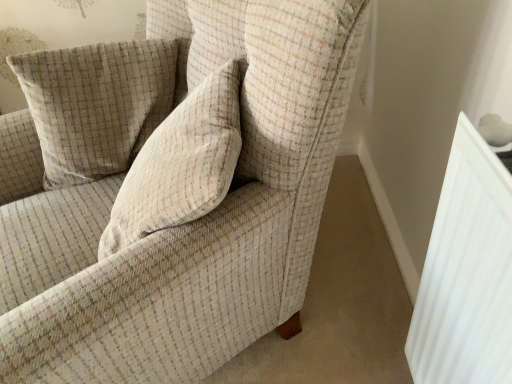
What is the approximate height of textured beige armchair at center?

36.26 inches.

Measure the distance between beige textured cushion at upper left and camera.

The depth of beige textured cushion at upper left is 38.02 inches.

Find the location of a particular element. The height and width of the screenshot is (384, 512). white ribbed radiator at right is located at coordinates (466, 272).

Find the location of a particular element. The image size is (512, 384). textured beige armchair at center is located at coordinates (169, 189).

Based on the photo, can you tell me how much textured beige armchair at center and white ribbed radiator at right differ in facing direction?

30.8 degrees.

Is textured beige armchair at center positioned with its back to white ribbed radiator at right?

No, textured beige armchair at center's orientation is not away from white ribbed radiator at right.

From the image's perspective, which object appears higher, textured beige armchair at center or white ribbed radiator at right?

textured beige armchair at center, from the image's perspective.

Measure the distance from textured beige armchair at center to white ribbed radiator at right.

A distance of 18.83 inches exists between textured beige armchair at center and white ribbed radiator at right.

From the image's perspective, which is below, white ribbed radiator at right or beige textured cushion at upper left?

From the image's view, white ribbed radiator at right is below.

Considering the points (434, 256) and (155, 45), which point is in front, point (434, 256) or point (155, 45)?

Point (434, 256)

Is white ribbed radiator at right oriented towards beige textured cushion at upper left?

No, white ribbed radiator at right is not turned towards beige textured cushion at upper left.

Can you confirm if white ribbed radiator at right is smaller than beige textured cushion at upper left?

Yes.

Does beige textured cushion at upper left have a greater width compared to textured beige armchair at center?

In fact, beige textured cushion at upper left might be narrower than textured beige armchair at center.

Measure the distance between beige textured cushion at upper left and textured beige armchair at center.

They are 17.79 centimeters apart.

Considering the positions of objects beige textured cushion at upper left and textured beige armchair at center in the image provided, who is behind, beige textured cushion at upper left or textured beige armchair at center?

beige textured cushion at upper left is further away from the camera.

How many degrees apart are the facing directions of beige textured cushion at upper left and textured beige armchair at center?

The angular difference between beige textured cushion at upper left and textured beige armchair at center is 73.9 degrees.

Which is behind, point (154, 288) or point (146, 71)?

The point (146, 71) is farther.

Which object is further away from the camera, textured beige armchair at center or beige textured cushion at upper left?

beige textured cushion at upper left is further from the camera.

Is textured beige armchair at center positioned beyond the bounds of beige textured cushion at upper left?

Indeed, textured beige armchair at center is completely outside beige textured cushion at upper left.

What are the coordinates of `chair located below the beige textured cushion at upper left (from the image's perspective)` in the screenshot? It's located at (169, 189).

Does white ribbed radiator at right touch textured beige armchair at center?

No, white ribbed radiator at right is not with textured beige armchair at center.

Based on their sizes in the image, would you say white ribbed radiator at right is bigger or smaller than textured beige armchair at center?

In the image, white ribbed radiator at right appears to be smaller than textured beige armchair at center.

Between white ribbed radiator at right and textured beige armchair at center, which one is positioned in front?

textured beige armchair at center is more forward.

From the image's perspective, is white ribbed radiator at right located above or below textured beige armchair at center?

Clearly, from the image's perspective, white ribbed radiator at right is below textured beige armchair at center.

Between beige textured cushion at upper left and white ribbed radiator at right, which one appears on the left side from the viewer's perspective?

Positioned to the left is beige textured cushion at upper left.

Is beige textured cushion at upper left situated inside white ribbed radiator at right or outside?

beige textured cushion at upper left exists outside the volume of white ribbed radiator at right.

From the image's perspective, does beige textured cushion at upper left appear lower than white ribbed radiator at right?

No.

Between beige textured cushion at upper left and white ribbed radiator at right, which one has larger width?

beige textured cushion at upper left.

At what (x,y) coordinates should I click in order to perform the action: click on radiator behind the textured beige armchair at center. Please return your answer as a coordinate pair (x, y). The height and width of the screenshot is (384, 512). Looking at the image, I should click on (466, 272).

Find the location of `radiator in front of the beige textured cushion at upper left`. radiator in front of the beige textured cushion at upper left is located at coordinates (466, 272).

When comparing their distances from beige textured cushion at upper left, does textured beige armchair at center or white ribbed radiator at right seem closer?

textured beige armchair at center.

When comparing their distances from white ribbed radiator at right, does beige textured cushion at upper left or textured beige armchair at center seem further?

beige textured cushion at upper left is further to white ribbed radiator at right.

From the image, which object appears to be nearer to textured beige armchair at center, white ribbed radiator at right or beige textured cushion at upper left?

Among the two, beige textured cushion at upper left is located nearer to textured beige armchair at center.

Based on their spatial positions, is textured beige armchair at center or beige textured cushion at upper left closer to white ribbed radiator at right?

The object closer to white ribbed radiator at right is textured beige armchair at center.

Estimate the real-world distances between objects in this image. Which object is further from beige textured cushion at upper left, white ribbed radiator at right or textured beige armchair at center?

white ribbed radiator at right lies further to beige textured cushion at upper left than the other object.

Looking at this image, based on their spatial positions, is beige textured cushion at upper left or white ribbed radiator at right further from textured beige armchair at center?

white ribbed radiator at right.

What are the coordinates of `chair between beige textured cushion at upper left and white ribbed radiator at right from left to right` in the screenshot? It's located at (169, 189).